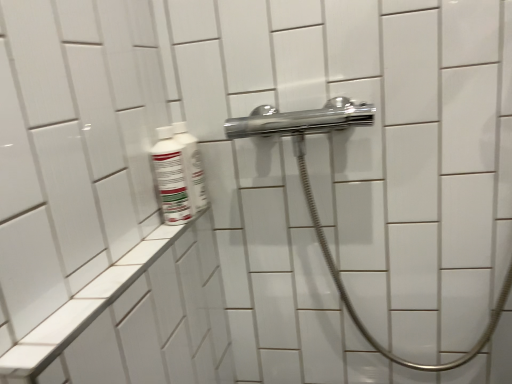
Locate an element on the screen. The image size is (512, 384). blank space situated above white ceramic ledge at lower left (from a real-world perspective) is located at coordinates click(131, 263).